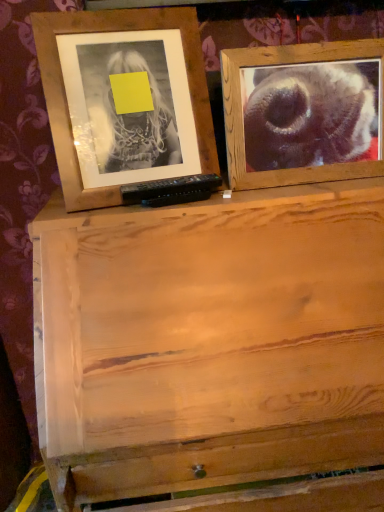
Question: Is wooden frame at upper right, positioned as the second picture frame in left-to-right order, completely or partially outside of wooden frame at upper left, which is the 1th picture frame in left-to-right order?

Choices:
 (A) yes
 (B) no

Answer: (A)

Question: Is wooden frame at upper right, acting as the first picture frame starting from the right, directly adjacent to wooden frame at upper left, which is the 1th picture frame in left-to-right order?

Choices:
 (A) yes
 (B) no

Answer: (B)

Question: Is wooden frame at upper right, acting as the first picture frame starting from the right, behind wooden frame at upper left, placed as the second picture frame when sorted from right to left?

Choices:
 (A) no
 (B) yes

Answer: (B)

Question: Considering the relative sizes of wooden frame at upper right, acting as the first picture frame starting from the right, and wooden frame at upper left, which is the 1th picture frame in left-to-right order, in the image provided, is wooden frame at upper right, acting as the first picture frame starting from the right, smaller than wooden frame at upper left, which is the 1th picture frame in left-to-right order,?

Choices:
 (A) yes
 (B) no

Answer: (A)

Question: Does wooden frame at upper right, positioned as the second picture frame in left-to-right order, have a greater width compared to wooden frame at upper left, which is the 1th picture frame in left-to-right order?

Choices:
 (A) yes
 (B) no

Answer: (B)

Question: From the image's perspective, would you say wooden frame at upper right, positioned as the second picture frame in left-to-right order, is positioned over wooden frame at upper left, placed as the second picture frame when sorted from right to left?

Choices:
 (A) yes
 (B) no

Answer: (B)

Question: From a real-world perspective, is wooden frame at upper left, placed as the second picture frame when sorted from right to left, positioned over wooden frame at upper right, acting as the first picture frame starting from the right, based on gravity?

Choices:
 (A) yes
 (B) no

Answer: (A)

Question: Considering the relative positions of wooden frame at upper left, placed as the second picture frame when sorted from right to left, and wooden frame at upper right, acting as the first picture frame starting from the right, in the image provided, is wooden frame at upper left, placed as the second picture frame when sorted from right to left, in front of wooden frame at upper right, acting as the first picture frame starting from the right,?

Choices:
 (A) yes
 (B) no

Answer: (A)

Question: Is wooden frame at upper right, positioned as the second picture frame in left-to-right order, surrounded by wooden frame at upper left, placed as the second picture frame when sorted from right to left?

Choices:
 (A) yes
 (B) no

Answer: (B)

Question: Can you confirm if wooden frame at upper left, which is the 1th picture frame in left-to-right order, is taller than wooden frame at upper right, positioned as the second picture frame in left-to-right order?

Choices:
 (A) yes
 (B) no

Answer: (A)

Question: From the image's perspective, is wooden frame at upper left, placed as the second picture frame when sorted from right to left, on top of wooden frame at upper right, acting as the first picture frame starting from the right?

Choices:
 (A) yes
 (B) no

Answer: (A)

Question: Is wooden frame at upper left, placed as the second picture frame when sorted from right to left, in contact with wooden frame at upper right, positioned as the second picture frame in left-to-right order?

Choices:
 (A) yes
 (B) no

Answer: (B)

Question: Considering their positions, is wooden frame at upper right, acting as the first picture frame starting from the right, located in front of or behind wooden frame at upper left, which is the 1th picture frame in left-to-right order?

Choices:
 (A) behind
 (B) front

Answer: (A)